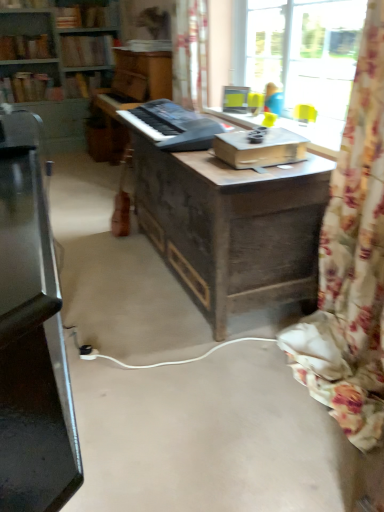
Locate an element on the screen. free space between dark wood table at center and floral fabric curtain at right, acting as the 1th curtain starting from the bottom is located at coordinates (265, 374).